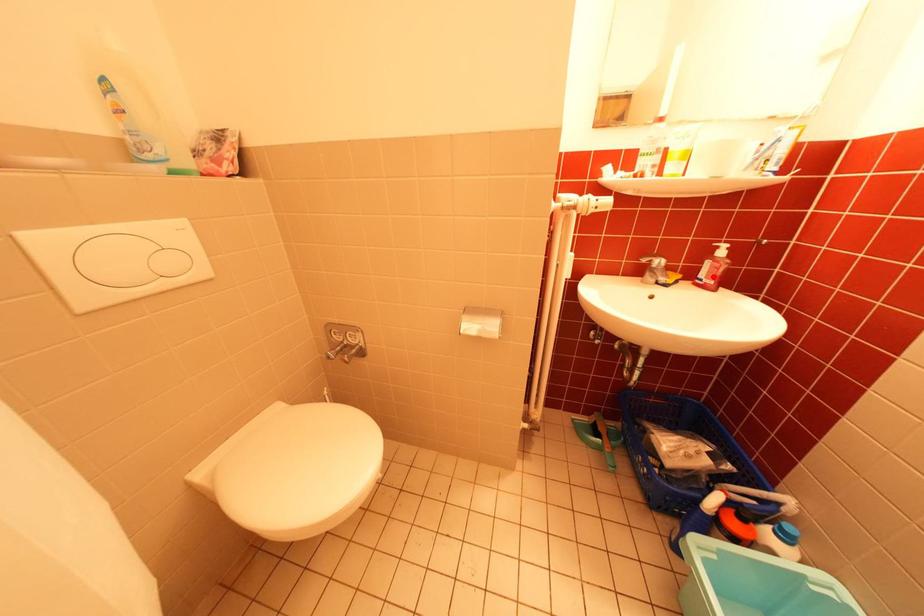
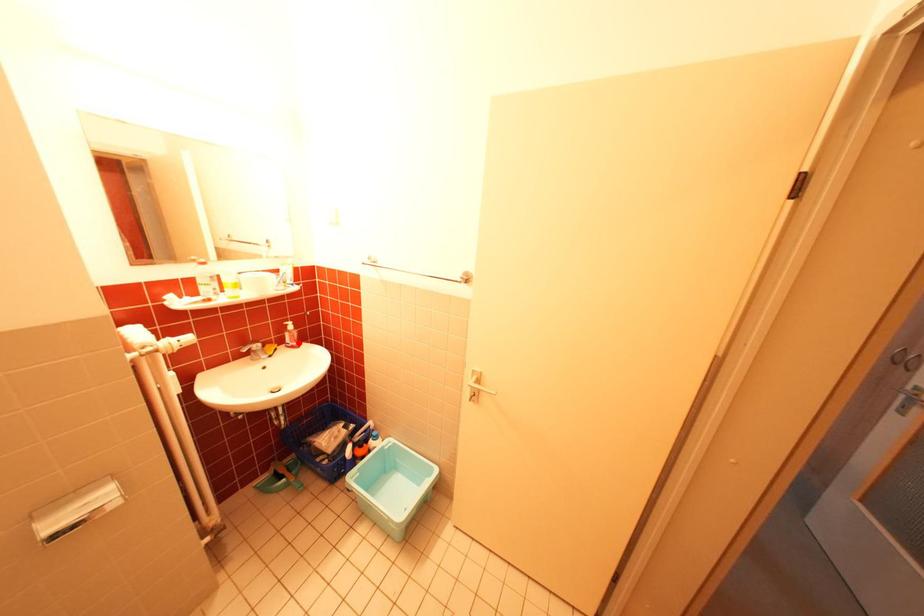
I am providing you with two images of the same scene from different viewpoints. A red point is marked on the first image and another point is marked on the second image. Do the highlighted points in image1 and image2 indicate the same real-world spot?

Yes